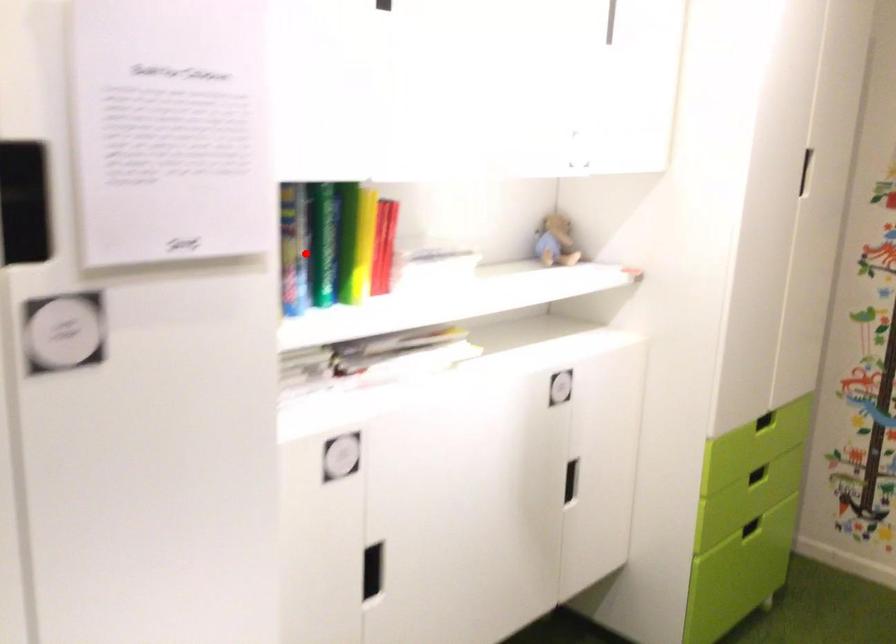
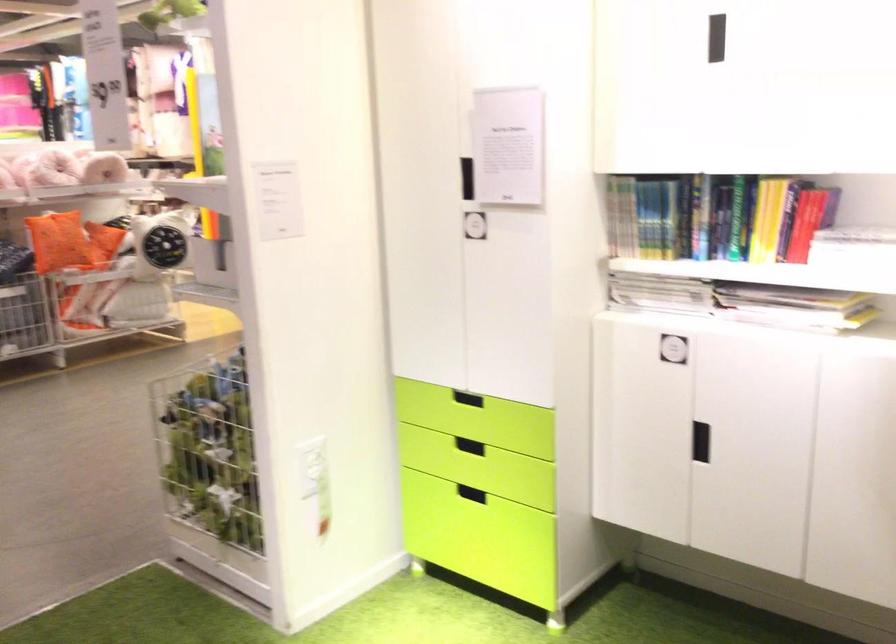
Question: I am providing you with two images of the same scene from different viewpoints. In image1, a red point is highlighted. Considering the same 3D point in image2, which of the following is correct?

Choices:
 (A) It is closer
 (B) It is farther

Answer: (B)